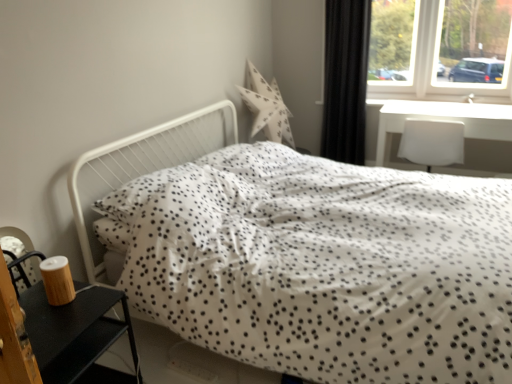
Question: Would you say black fabric curtain at upper right is inside or outside white plastic chair at right?

Choices:
 (A) outside
 (B) inside

Answer: (A)

Question: From the image's perspective, is black fabric curtain at upper right above or below white plastic chair at right?

Choices:
 (A) below
 (B) above

Answer: (B)

Question: Which object is the farthest from the wooden nightstand at lower left?

Choices:
 (A) black fabric curtain at upper right
 (B) transparent glass window at upper right
 (C) white dotted fabric bed at center
 (D) white plastic chair at right
 (E) white plastic chair at right

Answer: (B)

Question: Considering the real-world distances, which object is closest to the wooden nightstand at lower left?

Choices:
 (A) white plastic chair at right
 (B) white plastic chair at right
 (C) transparent glass window at upper right
 (D) black fabric curtain at upper right
 (E) white dotted fabric bed at center

Answer: (E)